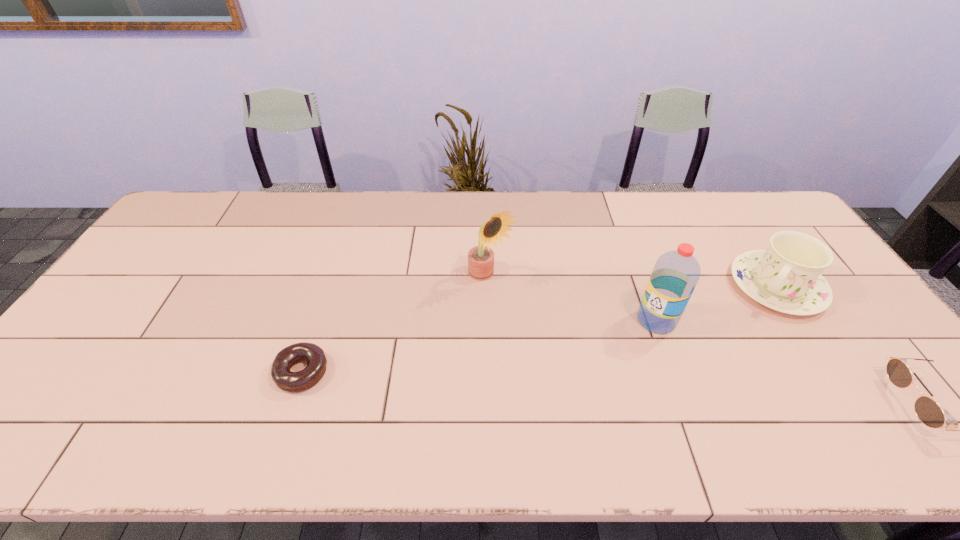
Where is `free space at the near left corner`? This screenshot has width=960, height=540. free space at the near left corner is located at coordinates (97, 404).

Find the location of a particular element. free space at the far right corner is located at coordinates (728, 194).

Where is `free space that is in between the fourth object from right to left and the third object from left to right`? This screenshot has height=540, width=960. free space that is in between the fourth object from right to left and the third object from left to right is located at coordinates (573, 299).

Where is `free space between the third tallest object and the leftmost object`? The image size is (960, 540). free space between the third tallest object and the leftmost object is located at coordinates (540, 329).

Where is `vacant area between the sunflower and the doughnut`? This screenshot has width=960, height=540. vacant area between the sunflower and the doughnut is located at coordinates (x=396, y=325).

Identify the location of free space that is in between the second object from left to right and the third shortest object. (634, 282).

The width and height of the screenshot is (960, 540). What are the coordinates of `free spot between the water bottle and the third tallest object` in the screenshot? It's located at (716, 303).

This screenshot has width=960, height=540. Identify the location of empty space that is in between the doughnut and the chinaware. (540, 329).

Where is `free space between the second object from left to right and the water bottle`? This screenshot has height=540, width=960. free space between the second object from left to right and the water bottle is located at coordinates (573, 299).

Locate which object is the closest to the sunglasses. Please provide its 2D coordinates. Your answer should be formatted as a tuple, i.e. [(x, y)], where the tuple contains the x and y coordinates of a point satisfying the conditions above.

[(786, 277)]